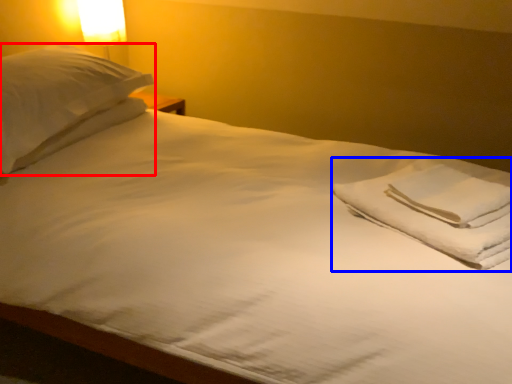
Question: Among these objects, which one is farthest to the camera, pillow (highlighted by a red box) or material (highlighted by a blue box)?

Choices:
 (A) pillow
 (B) material

Answer: (A)